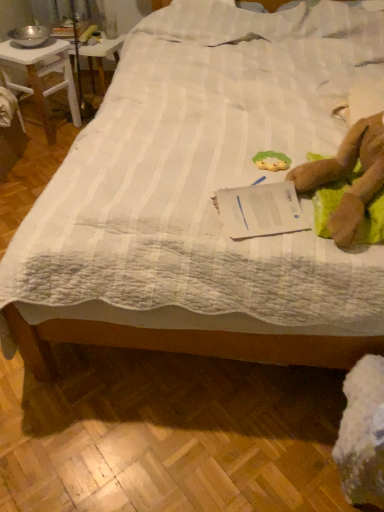
Image resolution: width=384 pixels, height=512 pixels. I want to click on vacant space in front of white wood desk at upper left, so click(x=42, y=158).